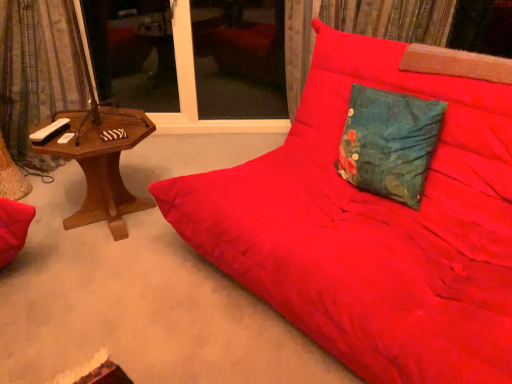
Locate an element on the screen. The image size is (512, 384). blank space to the left of woodenmaterial/texturetable at left is located at coordinates (48, 203).